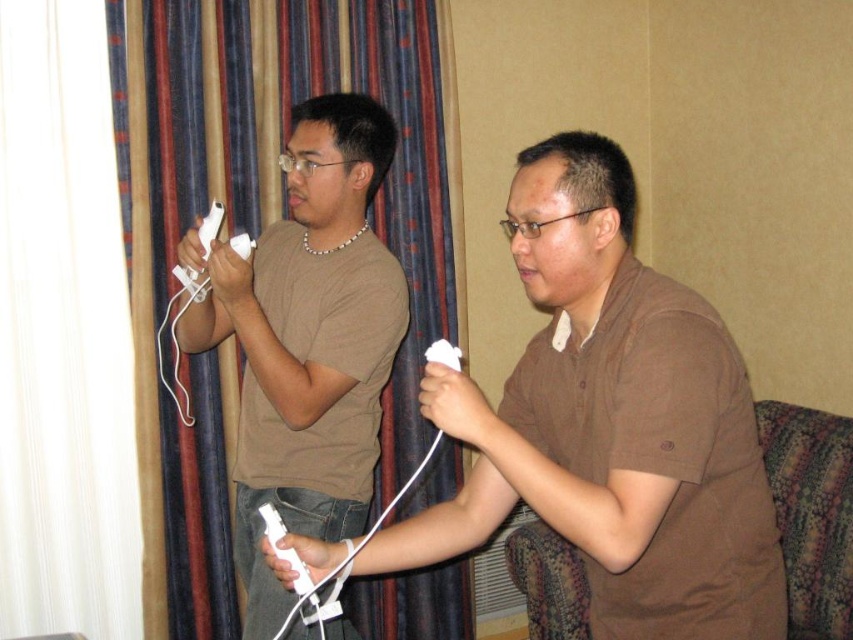
Question: Is striped fabric curtain at left bigger than white matte remote at center?

Choices:
 (A) no
 (B) yes

Answer: (B)

Question: Where is brown matte shirt at center located in relation to striped fabric curtain at left in the image?

Choices:
 (A) right
 (B) left

Answer: (A)

Question: Which object appears closest to the camera in this image?

Choices:
 (A) striped fabric curtain at left
 (B) brown matte shirt at center
 (C) white matte remote at center

Answer: (B)

Question: Which object appears farthest from the camera in this image?

Choices:
 (A) brown matte shirt at center
 (B) striped fabric curtain at left

Answer: (B)

Question: From the image, what is the correct spatial relationship of brown matte shirt at center in relation to striped fabric curtain at left?

Choices:
 (A) left
 (B) right

Answer: (B)

Question: Which point is closer to the camera?

Choices:
 (A) striped fabric curtain at left
 (B) white matte remote at center
 (C) brown matte shirt at center

Answer: (C)